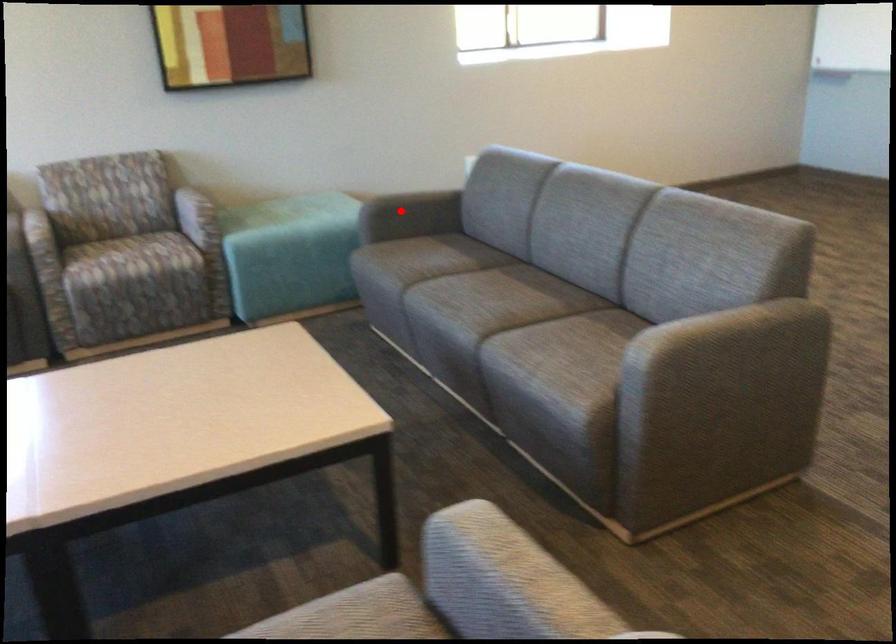
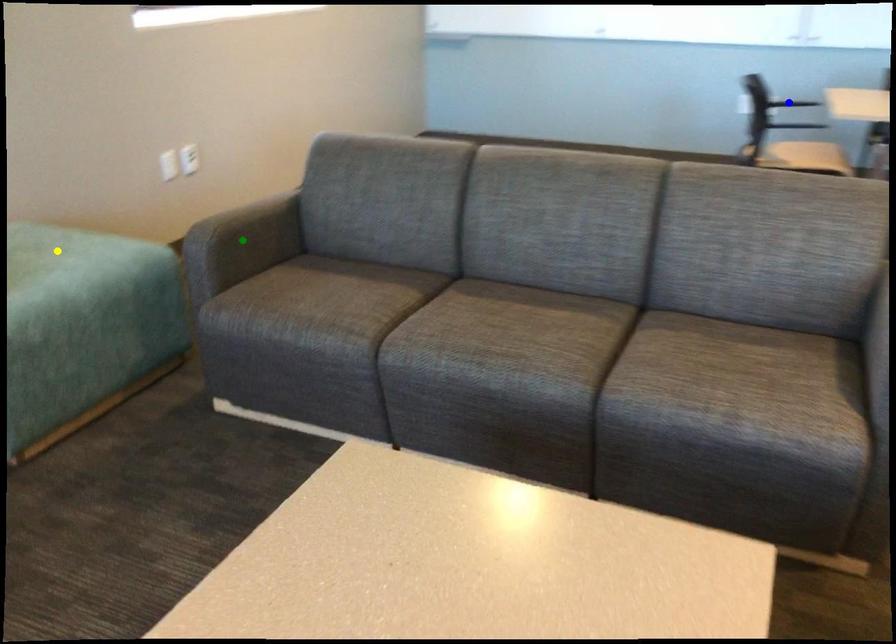
Question: I am providing you with two images of the same scene from different viewpoints. A red point is marked on the first image. You are given multiple points on the second image. In image 2, which mark is for the same physical point as the one in image 1?

Choices:
 (A) yellow point
 (B) green point
 (C) blue point

Answer: (B)